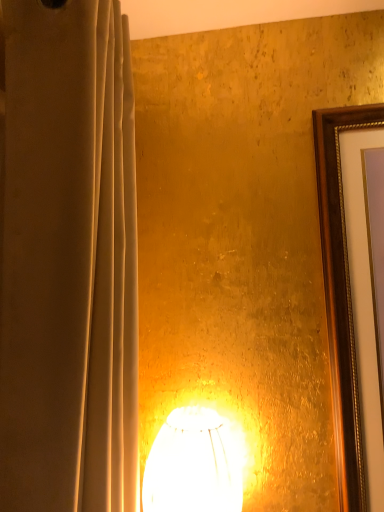
Identify the location of white fabric curtain at left. The image size is (384, 512). (x=68, y=260).

This screenshot has height=512, width=384. What do you see at coordinates (68, 260) in the screenshot?
I see `white fabric curtain at left` at bounding box center [68, 260].

Identify the location of white fabric curtain at left. (68, 260).